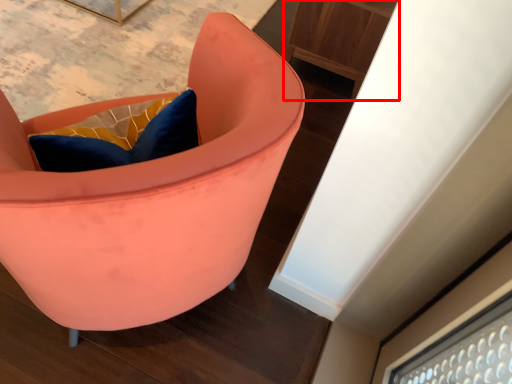
Question: From the image's perspective, considering the relative positions of furniture (annotated by the red box) and chair in the image provided, where is furniture (annotated by the red box) located with respect to the staircase?

Choices:
 (A) above
 (B) below

Answer: (A)